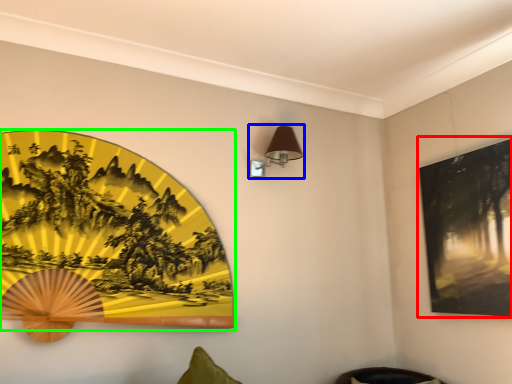
Question: Which object is the closest to the picture frame (highlighted by a red box)? Choose among these: table lamp (highlighted by a blue box) or picture frame (highlighted by a green box).

Choices:
 (A) table lamp
 (B) picture frame

Answer: (A)